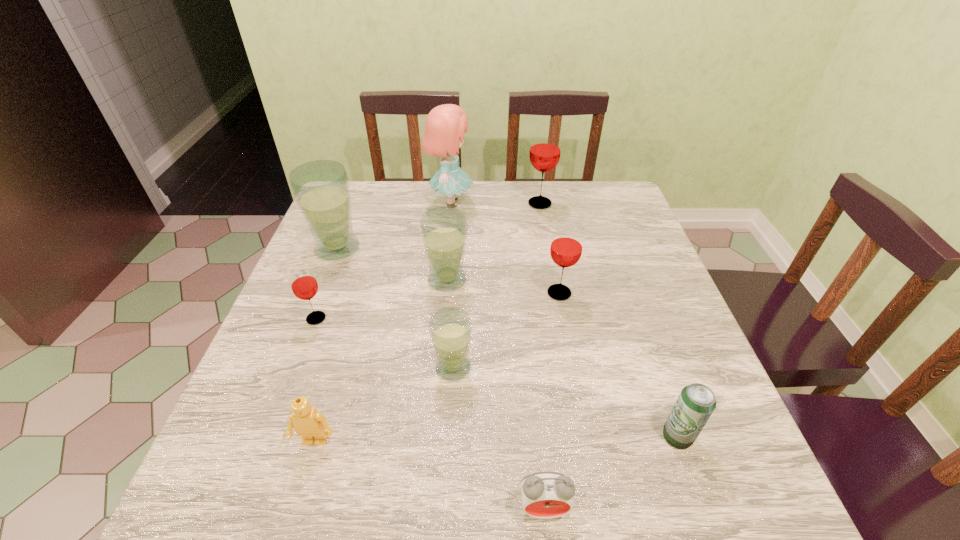
Image resolution: width=960 pixels, height=540 pixels. Identify the location of blank region between the red alarm clock and the nearest red glass. (429, 414).

You are a GUI agent. You are given a task and a screenshot of the screen. Output one action in this format:
    pyautogui.click(x=<x>, y=<y>)
    Task: Click on the free space between the second nearest red glass and the nearest glass
    This screenshot has width=960, height=540.
    Given the screenshot: What is the action you would take?
    pyautogui.click(x=506, y=330)

At what (x,y) coordinates should I click in order to perform the action: click on free space between the fourth object from right to left and the nearest blue glass. Please return your answer as a coordinate pair (x, y). The height and width of the screenshot is (540, 960). Looking at the image, I should click on (498, 438).

Where is `empty space that is in between the fourth object from right to left and the farthest blue glass`? Image resolution: width=960 pixels, height=540 pixels. empty space that is in between the fourth object from right to left and the farthest blue glass is located at coordinates (441, 379).

Where is `object that stands as the fourth closest to the tallest object`? object that stands as the fourth closest to the tallest object is located at coordinates (566, 248).

Identify which object is the eighth nearest to the second farthest glass. Please provide its 2D coordinates. Your answer should be formatted as a tuple, i.e. [(x, y)], where the tuple contains the x and y coordinates of a point satisfying the conditions above.

[(545, 495)]

At what (x,y) coordinates should I click in order to perform the action: click on glass that is the closest to the nearest object. Please return your answer as a coordinate pair (x, y). Looking at the image, I should click on (450, 329).

This screenshot has height=540, width=960. I want to click on the closest glass to the farthest blue glass, so click(x=304, y=285).

I want to click on the closest red glass to the nearest blue glass, so click(x=566, y=248).

Image resolution: width=960 pixels, height=540 pixels. I want to click on red glass that is the second closest to the Lego, so click(566, 248).